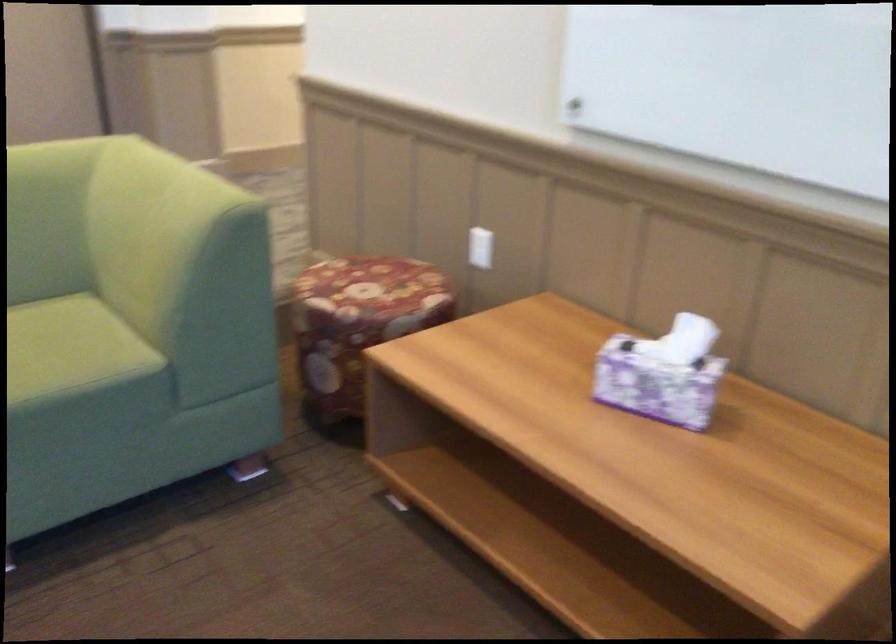
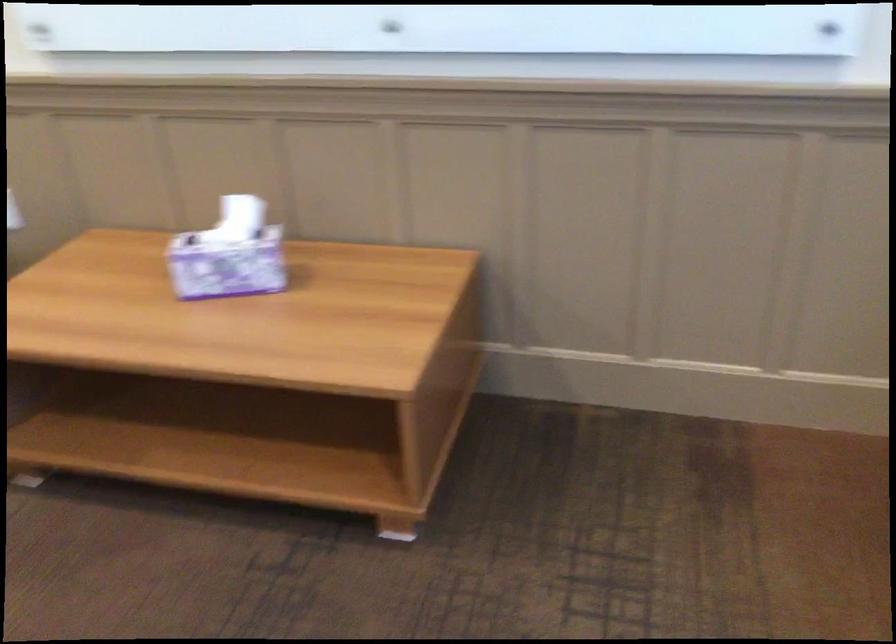
Question: The camera is either moving clockwise (left) or counter-clockwise (right) around the object. The first image is from the beginning of the video and the second image is from the end. Is the camera moving left or right when shooting the video?

Choices:
 (A) Left
 (B) Right

Answer: (A)